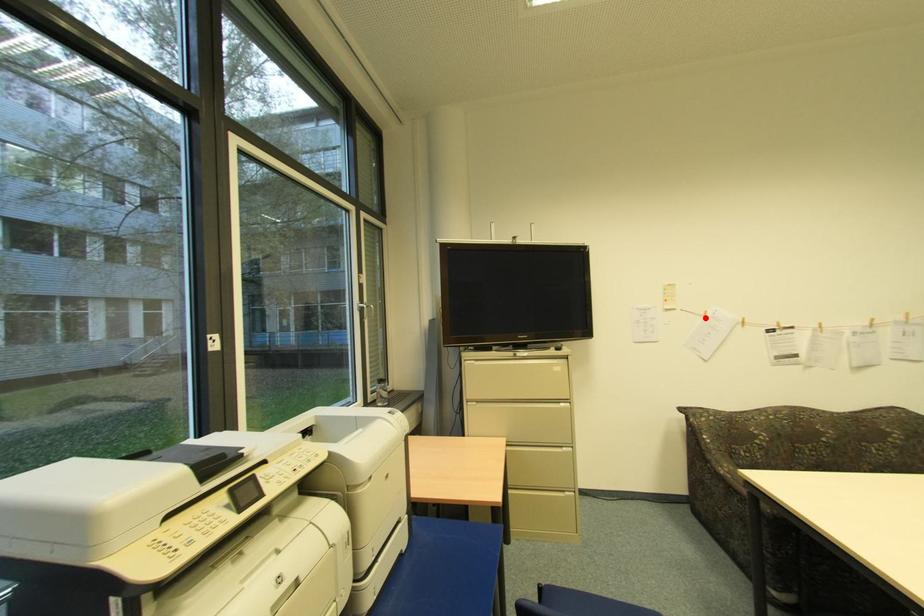
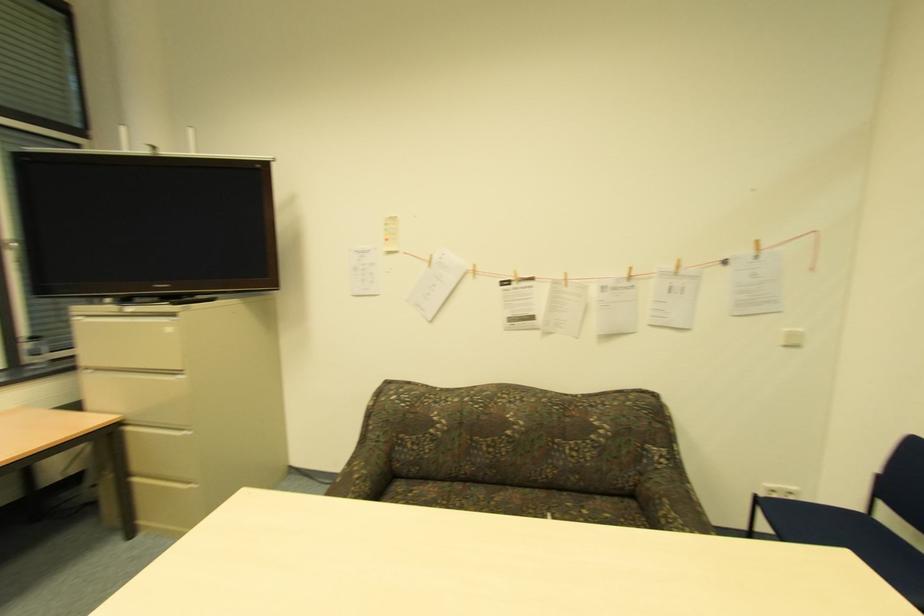
The point at the highlighted location is marked in the first image. Where is the corresponding point in the second image?

(428, 265)